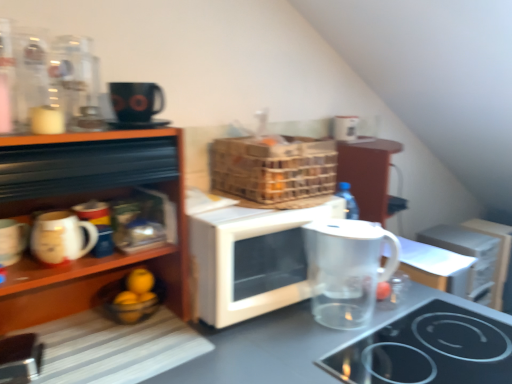
Question: Is point pos(194,314) positioned closer to the camera than point pos(362,365)?

Choices:
 (A) farther
 (B) closer

Answer: (A)

Question: Considering the positions of white matte microwave at center and black glass cooktop at lower right in the image, is white matte microwave at center bigger or smaller than black glass cooktop at lower right?

Choices:
 (A) small
 (B) big

Answer: (B)

Question: Which is farther from the white matte microwave at center?

Choices:
 (A) black glass cooktop at lower right
 (B) matte white mug at left, which appears as the 1th mug when viewed from the left
 (C) transparent glass pitcher at center
 (D) wooden shelves at left
 (E) transparent glass jug at lower right

Answer: (B)

Question: Which of these objects is positioned farthest from the transparent plastic pitcher at lower right?

Choices:
 (A) transparent glass pitcher at center
 (B) transparent glass jug at lower right
 (C) wooden shelves at left
 (D) white glossy mug at lower left, which is the second mug in left-to-right order
 (E) black glass cooktop at lower right

Answer: (D)